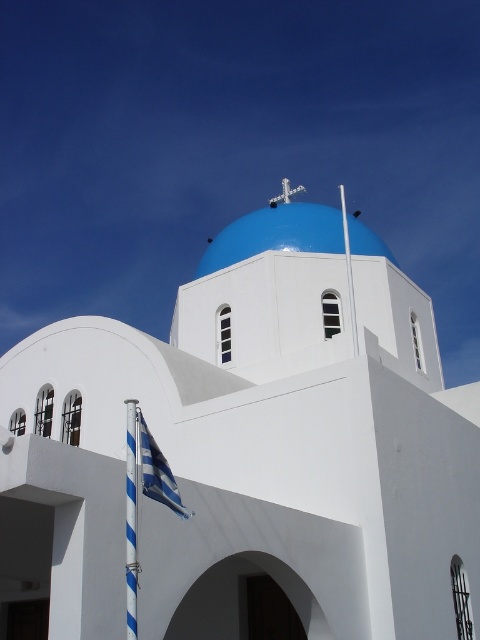
Describe the element at coordinates (275, 234) in the screenshot. I see `blue glossy dome at center` at that location.

Can you confirm if blue glossy dome at center is bigger than blue striped flag at lower left?

Yes.

Between point (302, 227) and point (156, 458), which one is positioned in front?

Point (156, 458) is more forward.

At what (x,y) coordinates should I click in order to perform the action: click on blue glossy dome at center. Please return your answer as a coordinate pair (x, y). The width and height of the screenshot is (480, 640). Looking at the image, I should click on (275, 234).

Is white smooth dome at center thinner than blue glossy dome at center?

In fact, white smooth dome at center might be wider than blue glossy dome at center.

Can you confirm if white smooth dome at center is smaller than blue glossy dome at center?

Yes.

Between point (111, 483) and point (309, 214), which one is positioned behind?

Point (309, 214)

The image size is (480, 640). In order to click on white smooth dome at center in this screenshot , I will do `click(247, 454)`.

Does point (445, 467) come in front of point (179, 513)?

No.

How distant is white smooth dome at center from blue striped flag at lower left?

They are 13.84 meters apart.

This screenshot has height=640, width=480. What do you see at coordinates (247, 454) in the screenshot? I see `white smooth dome at center` at bounding box center [247, 454].

Locate an element on the screen. white smooth dome at center is located at coordinates (247, 454).